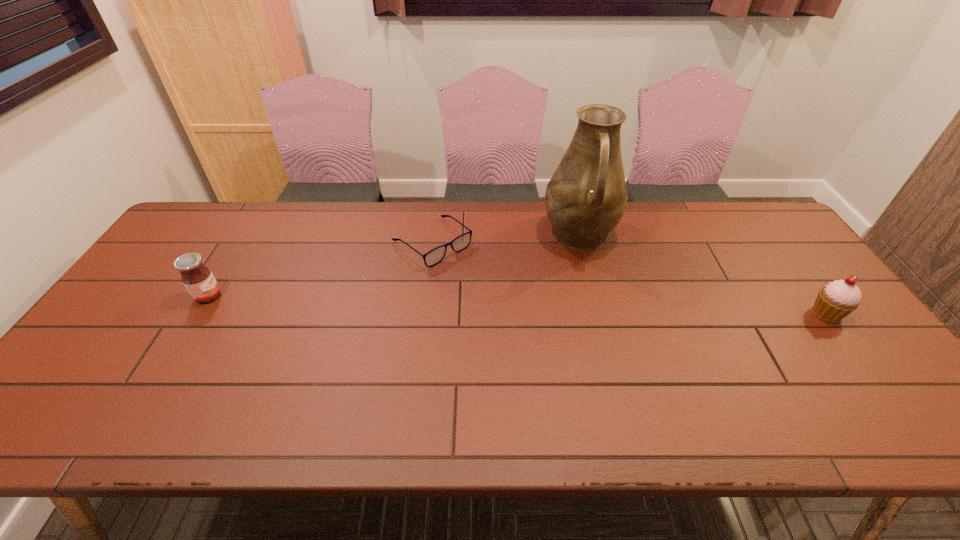
Find the location of a particular element. The image size is (960, 540). vacant space on the desktop that is between the leftmost object and the cupcake and is positioned on the front-facing side of the shortest object is located at coordinates (508, 305).

Find the location of a particular element. The height and width of the screenshot is (540, 960). free space on the desktop that is between the leftmost object and the cupcake and is positioned on the handle side of the pitcher is located at coordinates (591, 307).